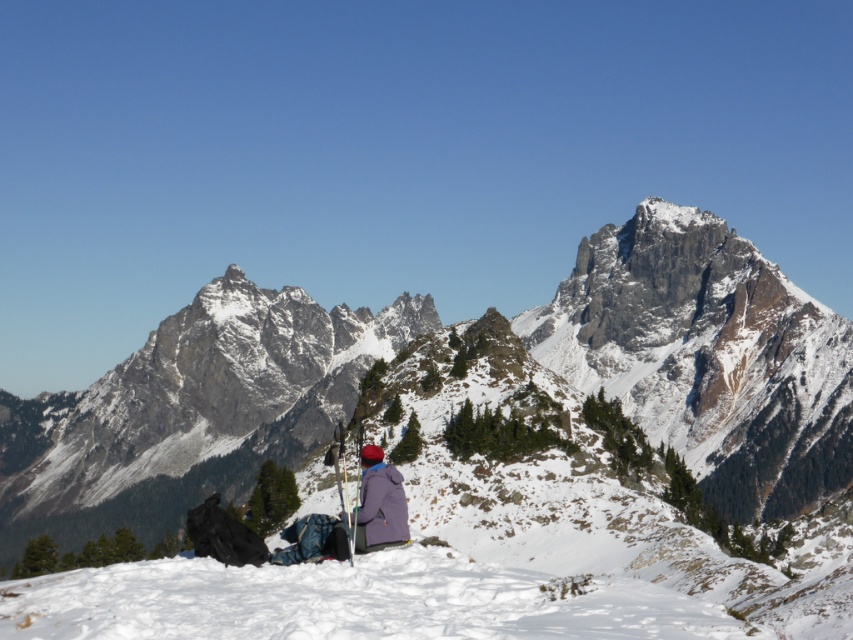
You are planning to take a photo of the snowy rocky mountain at center and the purple fleece jacket at center from the current viewpoint. Which object will appear higher in the photo?

The snowy rocky mountain at center will appear higher in the photo because it is positioned over the purple fleece jacket at center.

You are an AI analyzing the image. The coordinate system has its origin at the bottom left corner of the image. The snowy rocky mountain at center is located at what coordinates?

The snowy rocky mountain at center is located at coordinates (706,356).

Looking at this image, you are planning to take a photo of the snowy rocky mountain at center from the position of the purple fleece jacket at center. Considering the distance between them, will the mountain be fully visible in your camera frame without any zoom adjustments?

The snowy rocky mountain at center and purple fleece jacket at center are 102.38 meters apart. Depending on the camera lens used, the mountain may or may not be fully visible without zoom. A standard lens might require slight zoom to capture the entire mountain, while a wide angle could include it. However, the exact visibility depends on the camera specifications not provided here.